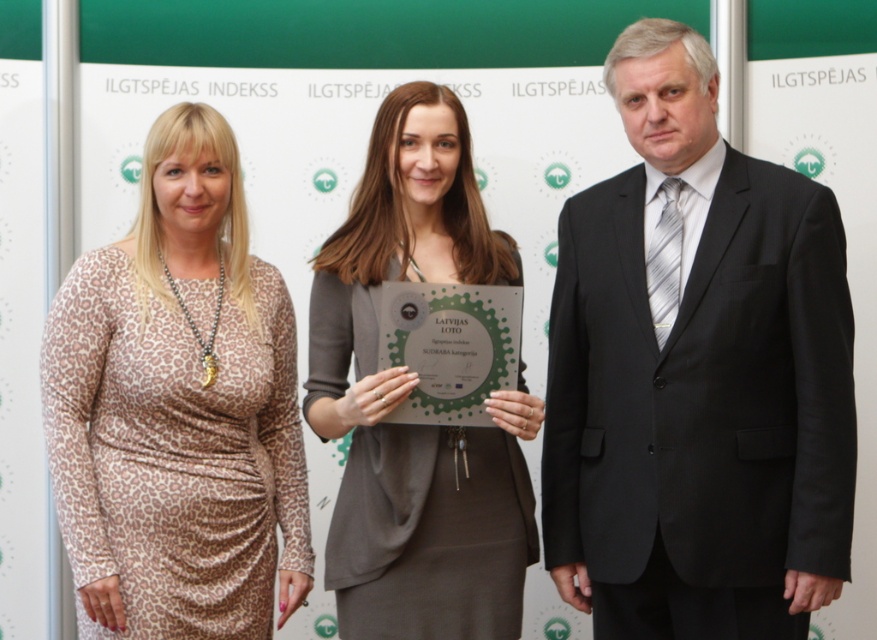
Question: Based on their relative distances, which object is farther from the matte gray dress at center?

Choices:
 (A) black suit at right
 (B) leopard print dress at left

Answer: (A)

Question: Among these objects, which one is farthest from the camera?

Choices:
 (A) matte gray dress at center
 (B) black suit at right
 (C) leopard print dress at left

Answer: (A)

Question: From the image, what is the correct spatial relationship of black suit at right in relation to leopard print dress at left?

Choices:
 (A) below
 (B) above

Answer: (B)

Question: Is leopard print dress at left wider than matte gray dress at center?

Choices:
 (A) no
 (B) yes

Answer: (B)

Question: Which point appears farthest from the camera in this image?

Choices:
 (A) tap(407, 184)
 (B) tap(561, 353)
 (C) tap(212, 141)

Answer: (A)

Question: Can you confirm if black suit at right is thinner than leopard print dress at left?

Choices:
 (A) no
 (B) yes

Answer: (A)